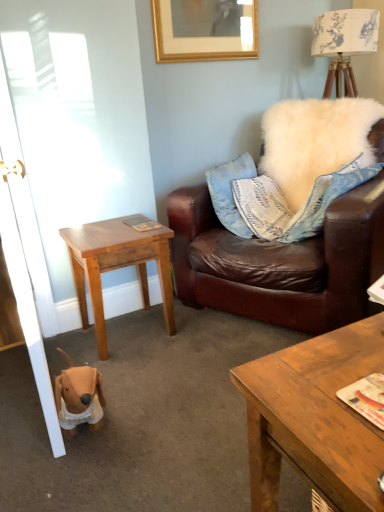
Describe the element at coordinates (117, 266) in the screenshot. I see `light brown wooden table at lower left` at that location.

Identify the location of wooden coffee table at lower right. (315, 418).

The width and height of the screenshot is (384, 512). What do you see at coordinates (326, 199) in the screenshot? I see `white fluffy pillow at upper right` at bounding box center [326, 199].

In order to face gold wooden picture frame at upper center, should I rotate leftwards or rightwards?

You should look right and rotate roughly 2.508 degrees.

I want to click on light brown wooden table at lower left, so click(x=117, y=266).

Which object is further away from the camera, gold wooden picture frame at upper center or white fluffy pillow at upper right?

gold wooden picture frame at upper center is more distant.

Which is closer, [244,23] or [311,228]?

Point [244,23] is farther from the camera than point [311,228].

Between gold wooden picture frame at upper center and white fluffy pillow at upper right, which one has more height?

white fluffy pillow at upper right.

Is gold wooden picture frame at upper center to the left of white fluffy pillow at upper right from the viewer's perspective?

Indeed, gold wooden picture frame at upper center is positioned on the left side of white fluffy pillow at upper right.

From the image's perspective, does gold wooden picture frame at upper center appear lower than white glossy door at left?

Actually, gold wooden picture frame at upper center appears above white glossy door at left in the image.

Looking at this image, is gold wooden picture frame at upper center completely or partially outside of white glossy door at left?

gold wooden picture frame at upper center is positioned outside white glossy door at left.

Can you see gold wooden picture frame at upper center touching white glossy door at left?

No.

Which is farther, (156, 48) or (4, 88)?

The point (156, 48) is behind.

Does wooden coffee table at lower right lie behind white fluffy pillow at upper right?

No, wooden coffee table at lower right is in front of white fluffy pillow at upper right.

Between wooden coffee table at lower right and white fluffy pillow at upper right, which one appears on the right side from the viewer's perspective?

white fluffy pillow at upper right is more to the right.

Locate an element on the screen. Image resolution: width=384 pixels, height=512 pixels. coffee table that appears on the left of white fluffy pillow at upper right is located at coordinates (315, 418).

Could you tell me if wooden coffee table at lower right is turned towards white fluffy pillow at upper right?

No, wooden coffee table at lower right is not turned towards white fluffy pillow at upper right.

How distant is white glossy door at left from wooden coffee table at lower right?

white glossy door at left is 4.36 feet from wooden coffee table at lower right.

How many degrees apart are the facing directions of white glossy door at left and wooden coffee table at lower right?

88.4 degrees.

Considering the sizes of objects white glossy door at left and wooden coffee table at lower right in the image provided, who is thinner, white glossy door at left or wooden coffee table at lower right?

Thinner between the two is wooden coffee table at lower right.

From a real-world perspective, is white glossy door at left physically above wooden coffee table at lower right?

Indeed, from a real-world perspective, white glossy door at left stands above wooden coffee table at lower right.

Considering the relative sizes of white glossy door at left and gold wooden picture frame at upper center in the image provided, is white glossy door at left wider than gold wooden picture frame at upper center?

Yes.

From the picture: Is white glossy door at left in front of or behind gold wooden picture frame at upper center in the image?

white glossy door at left is positioned closer to the viewer than gold wooden picture frame at upper center.

Between point (11, 189) and point (182, 3), which one is positioned in front?

The point (11, 189) is closer.

Between white glossy door at left and white fluffy pillow at upper right, which one is positioned behind?

Positioned behind is white fluffy pillow at upper right.

From a real-world perspective, who is located higher, white glossy door at left or white fluffy pillow at upper right?

white glossy door at left.

Are white glossy door at left and white fluffy pillow at upper right making contact?

No.

From the image's perspective, which one is positioned lower, white glossy door at left or white fluffy pillow at upper right?

From the image's view, white glossy door at left is below.

Which of these two, wooden coffee table at lower right or white glossy door at left, is bigger?

white glossy door at left is bigger.

Which object is wider, wooden coffee table at lower right or white glossy door at left?

white glossy door at left is wider.

Which object is positioned more to the right, wooden coffee table at lower right or white glossy door at left?

wooden coffee table at lower right is more to the right.

From the image's perspective, is wooden coffee table at lower right located beneath white glossy door at left?

Yes, from the image's perspective, wooden coffee table at lower right is beneath white glossy door at left.

Where is `picture frame above the white fluffy pillow at upper right (from the image's perspective)`? The height and width of the screenshot is (512, 384). picture frame above the white fluffy pillow at upper right (from the image's perspective) is located at coordinates (204, 30).

You are a GUI agent. You are given a task and a screenshot of the screen. Output one action in this format:
    pyautogui.click(x=<x>, y=<y>)
    Task: Click on the door on the left of gold wooden picture frame at upper center
    
    Given the screenshot: What is the action you would take?
    pyautogui.click(x=29, y=289)

From the image, which object appears to be farther from gold wooden picture frame at upper center, light brown wooden table at lower left or wooden coffee table at lower right?

wooden coffee table at lower right is further to gold wooden picture frame at upper center.

When comparing their distances from gold wooden picture frame at upper center, does white glossy door at left or white fluffy pillow at upper right seem closer?

white glossy door at left is closer to gold wooden picture frame at upper center.

From the image, which object appears to be farther from gold wooden picture frame at upper center, white glossy door at left or light brown wooden table at lower left?

Based on the image, light brown wooden table at lower left appears to be further to gold wooden picture frame at upper center.

Considering their positions, is gold wooden picture frame at upper center positioned further to white fluffy pillow at upper right than light brown wooden table at lower left?

Among the two, gold wooden picture frame at upper center is located further to white fluffy pillow at upper right.

Looking at the image, which one is located closer to gold wooden picture frame at upper center, white fluffy pillow at upper right or wooden coffee table at lower right?

white fluffy pillow at upper right.

Looking at this image, considering their positions, is white glossy door at left positioned further to white fluffy pillow at upper right than light brown wooden table at lower left?

white glossy door at left.

From the image, which object appears to be nearer to wooden coffee table at lower right, gold wooden picture frame at upper center or white fluffy pillow at upper right?

white fluffy pillow at upper right is closer to wooden coffee table at lower right.

Considering their positions, is gold wooden picture frame at upper center positioned closer to white glossy door at left than white fluffy pillow at upper right?

gold wooden picture frame at upper center.

This screenshot has width=384, height=512. Find the location of `desk between wooden coffee table at lower right and white fluffy pillow at upper right along the z-axis`. desk between wooden coffee table at lower right and white fluffy pillow at upper right along the z-axis is located at coordinates (117, 266).

Identify the location of pillow between gold wooden picture frame at upper center and light brown wooden table at lower left vertically. (326, 199).

You are a GUI agent. You are given a task and a screenshot of the screen. Output one action in this format:
    pyautogui.click(x=<x>, y=<y>)
    Task: Click on the desk located between white glossy door at left and white fluffy pillow at upper right in the left-right direction
    The image size is (384, 512).
    Given the screenshot: What is the action you would take?
    [117, 266]

Identify the location of pillow between gold wooden picture frame at upper center and wooden coffee table at lower right in the vertical direction. This screenshot has height=512, width=384. (326, 199).